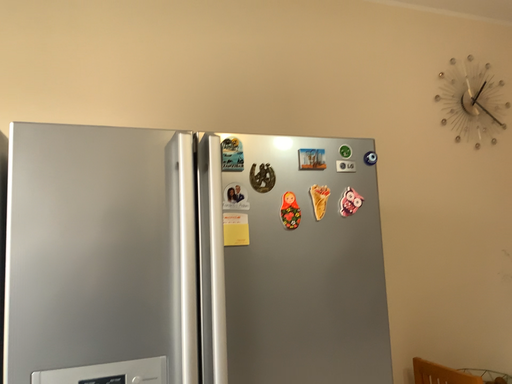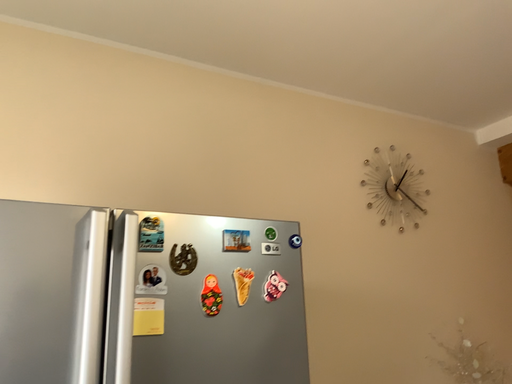
Question: How did the camera likely rotate when shooting the video?

Choices:
 (A) rotated upward
 (B) rotated downward

Answer: (A)